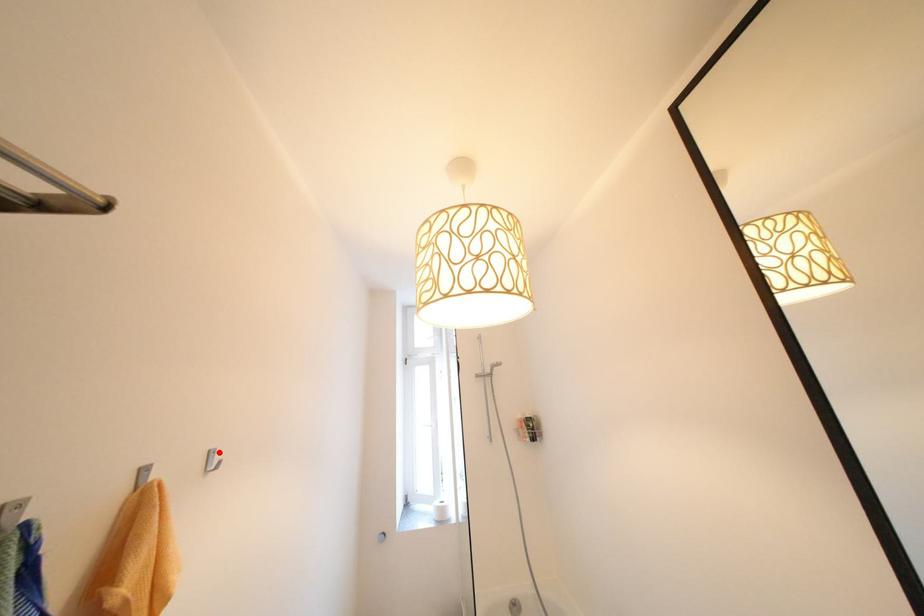
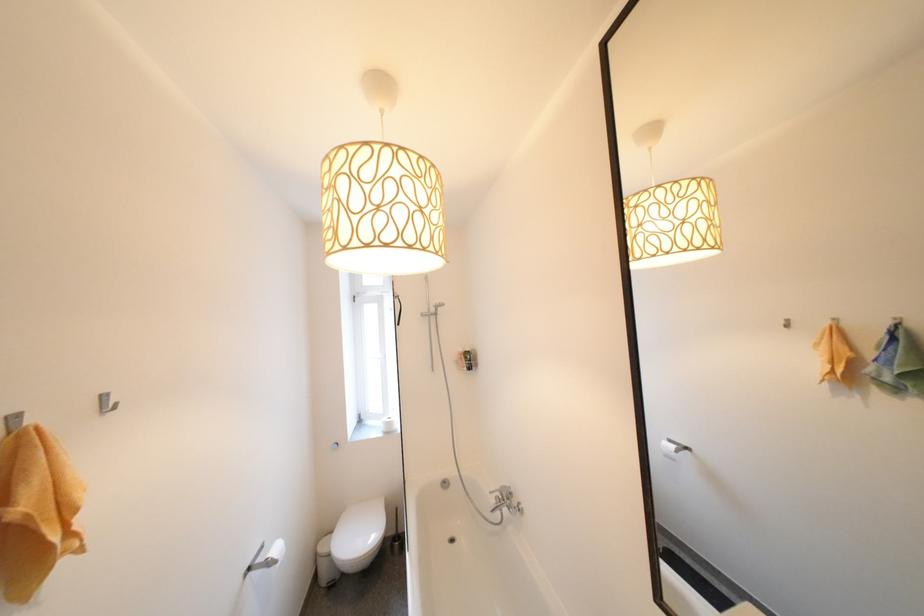
Find the pixel in the second image that matches the highlighted location in the first image.

(111, 397)